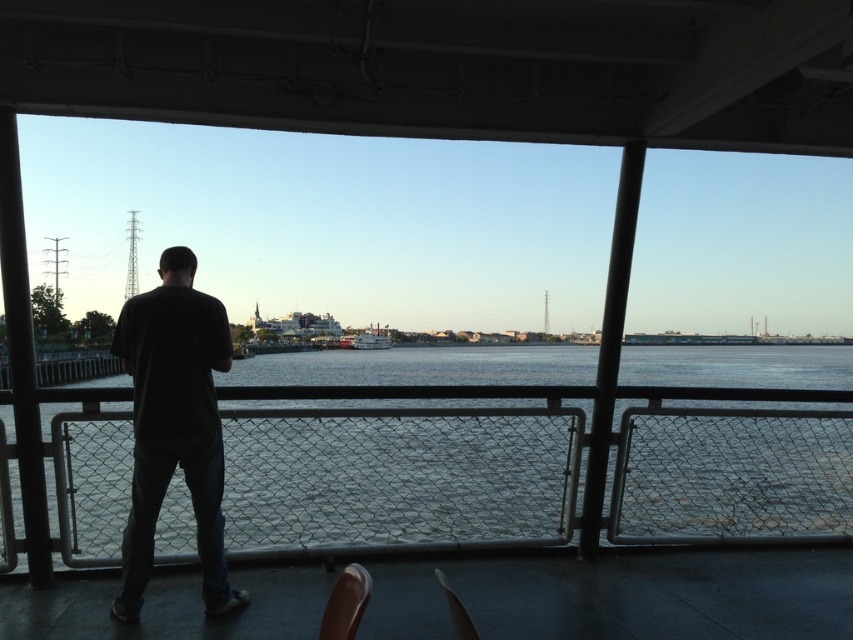
Looking at this image, you are standing inside a ferry and see a matte plastic chair at lower center and a white wooden boat at center. Which object is located to the right of the other?

The matte plastic chair at lower center is positioned on the right side of white wooden boat at center.

You are on a ferry and need to sit down. There is a dark matte shirt at center and a brown leather chair at lower center. Which object is closer to the floor?

The brown leather chair at lower center is closer to the floor since it is located below the dark matte shirt at center.

You are standing inside a covered structure on a ferry. You see a clear water at center and a dark matte shirt at center. Which object is closer to you?

The dark matte shirt at center is closer to you because the clear water at center is further away.